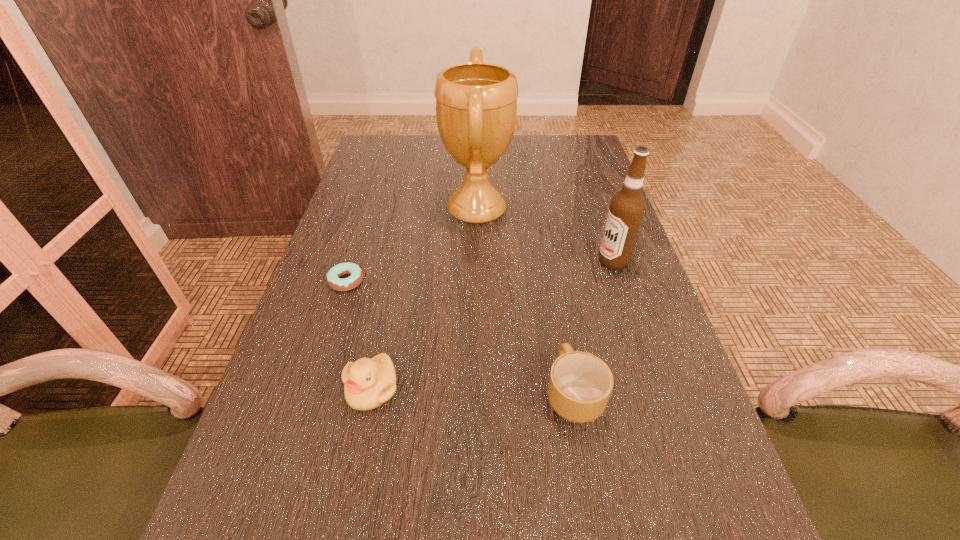
Locate an element on the screen. Image resolution: width=960 pixels, height=540 pixels. free space located 0.070m on the label of the second tallest object is located at coordinates (568, 261).

I want to click on free location located 0.150m on the label of the second tallest object, so click(535, 261).

The image size is (960, 540). I want to click on vacant space situated on the beak of the duckling, so click(x=343, y=528).

Identify the location of vacant area situated 0.090m on the side with the handle of the second object from right to left. The height and width of the screenshot is (540, 960). (562, 326).

This screenshot has width=960, height=540. In order to click on vacant space located on the side with the handle of the second object from right to left in this screenshot , I will do `click(546, 239)`.

Locate an element on the screen. This screenshot has width=960, height=540. vacant position located 0.120m on the side with the handle of the second object from right to left is located at coordinates [560, 315].

The width and height of the screenshot is (960, 540). Find the location of `free spot located on the front of the shortest object`. free spot located on the front of the shortest object is located at coordinates (324, 352).

Where is `duckling that is positioned at the left edge`? The image size is (960, 540). duckling that is positioned at the left edge is located at coordinates (368, 383).

Locate an element on the screen. This screenshot has height=540, width=960. doughnut at the left edge is located at coordinates (333, 276).

Locate an element on the screen. alcohol situated at the right edge is located at coordinates (627, 206).